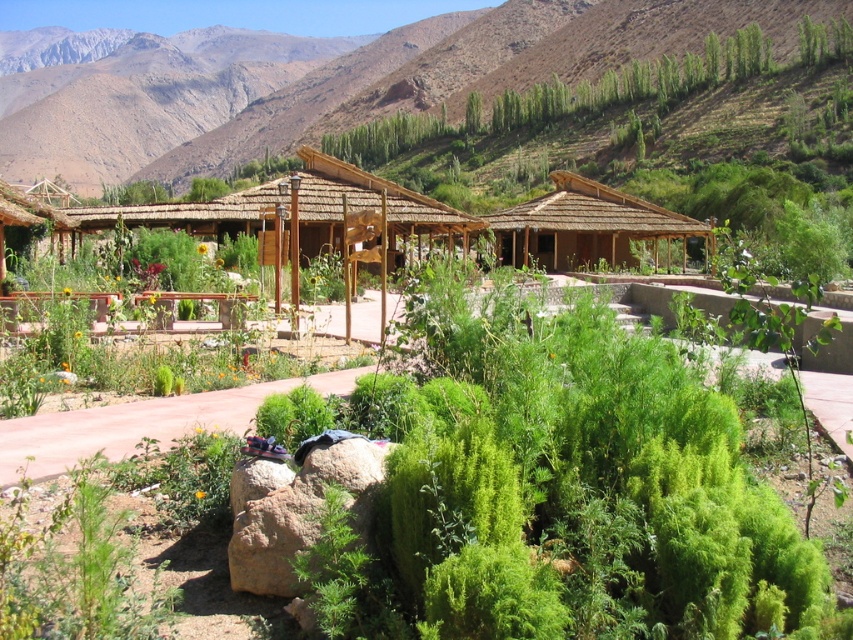
You are a hiker who wants to take a photo of the brown thatched hut at center and the brown rough boulder at lower center. Which object should you stand closer to in order to capture both in a single frame without zooming in or out?

You should stand closer to the brown rough boulder at lower center because the brown thatched hut at center is much taller than the brown rough boulder at lower center. By positioning yourself nearer to the smaller object, you can include both in your camera frame without needing to adjust the zoom.

You are standing at the entrance of the resort and want to locate the brown rough boulder at lower center. According to the coordinates provided, where exactly is it positioned in the image?

The brown rough boulder at lower center is located at coordinates point (300, 515) in the image.